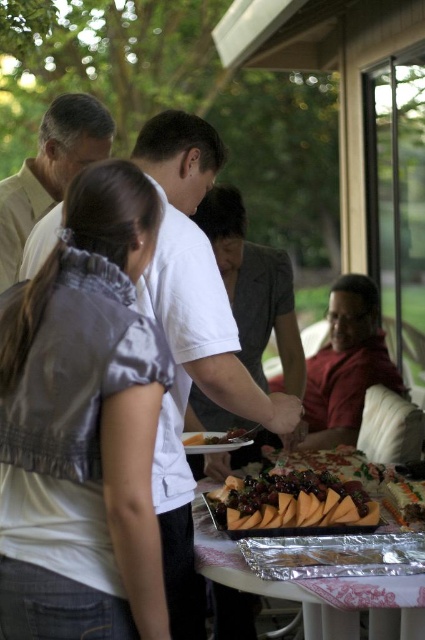
Is gray satin blouse at center shorter than matte gray dress at center?

Yes, gray satin blouse at center is shorter than matte gray dress at center.

Can you confirm if gray satin blouse at center is taller than matte gray dress at center?

No.

Where is `gray satin blouse at center`? This screenshot has width=425, height=640. gray satin blouse at center is located at coordinates (93, 376).

Does point (98, 353) come in front of point (359, 316)?

Yes.

Between point (16, 378) and point (345, 285), which one is positioned in front?

Positioned in front is point (16, 378).

Where is `gray satin blouse at center`? The image size is (425, 640). gray satin blouse at center is located at coordinates (93, 376).

Is light brown shirt at upper left positioned in front of sliced cheese at center?

No, it is not.

In the scene shown: Does light brown shirt at upper left have a greater height compared to sliced cheese at center?

Yes, light brown shirt at upper left is taller than sliced cheese at center.

Measure the distance between point (33, 157) and camera.

7.38 feet

At what (x,y) coordinates should I click in order to perform the action: click on light brown shirt at upper left. Please return your answer as a coordinate pair (x, y). This screenshot has height=640, width=425. Looking at the image, I should click on (50, 172).